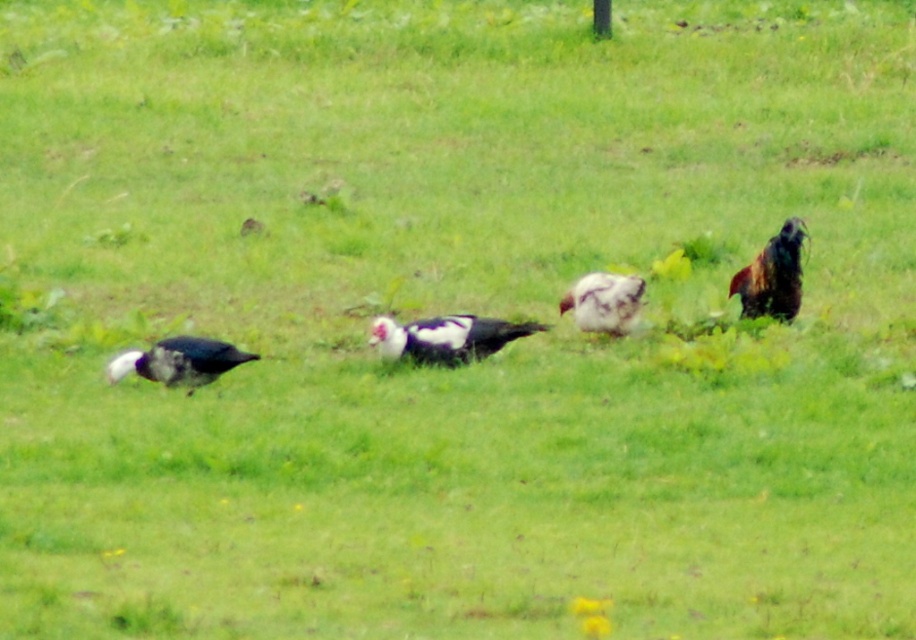
Based on the photo, is white-speckled feathered bird at center positioned before multicolored feathered rooster at right?

Yes, it is.

Is point (544, 324) behind point (761, 253)?

No.

Locate an element on the screen. This screenshot has height=640, width=916. white-speckled feathered bird at center is located at coordinates (446, 337).

Where is `white-speckled feathered bird at center`? This screenshot has height=640, width=916. white-speckled feathered bird at center is located at coordinates (446, 337).

Does white glossy bird at left appear on the left side of white speckled feather at center?

Correct, you'll find white glossy bird at left to the left of white speckled feather at center.

Is point (166, 342) farther from viewer compared to point (631, 321)?

No.

Locate an element on the screen. The image size is (916, 640). white glossy bird at left is located at coordinates (178, 362).

Is white glossy bird at left to the right of multicolored feathered rooster at right from the viewer's perspective?

No, white glossy bird at left is not to the right of multicolored feathered rooster at right.

This screenshot has width=916, height=640. I want to click on white glossy bird at left, so click(178, 362).

Where is `white glossy bird at left`? white glossy bird at left is located at coordinates (178, 362).